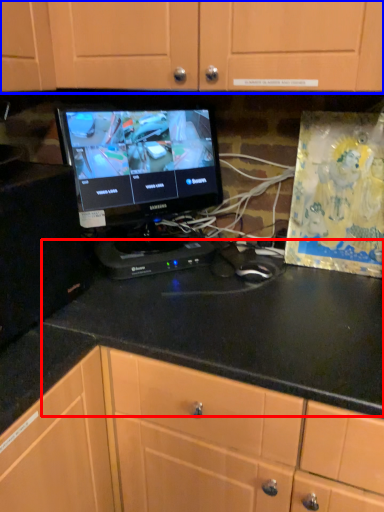
Question: Among these objects, which one is farthest to the camera, counter top (highlighted by a red box) or cabinetry (highlighted by a blue box)?

Choices:
 (A) counter top
 (B) cabinetry

Answer: (B)